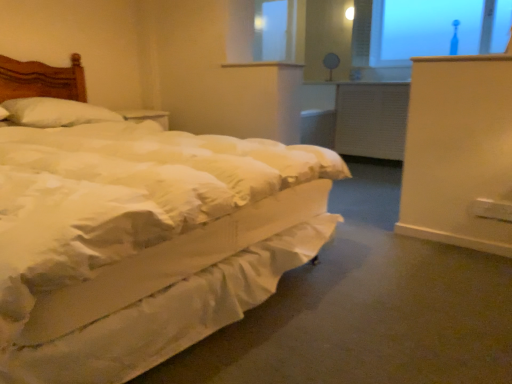
Question: Is transparent glass window at upper right wider than white soft pillow at left?

Choices:
 (A) no
 (B) yes

Answer: (A)

Question: Can you confirm if transparent glass window at upper right is positioned to the right of white soft pillow at left?

Choices:
 (A) yes
 (B) no

Answer: (A)

Question: Does transparent glass window at upper right have a lesser height compared to white soft pillow at left?

Choices:
 (A) yes
 (B) no

Answer: (B)

Question: Is transparent glass window at upper right outside white soft pillow at left?

Choices:
 (A) yes
 (B) no

Answer: (A)

Question: Is transparent glass window at upper right directly adjacent to white soft pillow at left?

Choices:
 (A) no
 (B) yes

Answer: (A)

Question: From the image's perspective, is matte white table lamp at upper center above or below white soft bed at left?

Choices:
 (A) above
 (B) below

Answer: (A)

Question: In terms of width, does matte white table lamp at upper center look wider or thinner when compared to white soft bed at left?

Choices:
 (A) thin
 (B) wide

Answer: (A)

Question: Visually, is matte white table lamp at upper center positioned to the left or to the right of white soft bed at left?

Choices:
 (A) right
 (B) left

Answer: (A)

Question: From their relative heights in the image, would you say matte white table lamp at upper center is taller or shorter than white soft bed at left?

Choices:
 (A) short
 (B) tall

Answer: (A)

Question: Considering the positions of transparent glass window at upper right and matte white table lamp at upper center in the image, is transparent glass window at upper right bigger or smaller than matte white table lamp at upper center?

Choices:
 (A) small
 (B) big

Answer: (B)

Question: Visually, is transparent glass window at upper right positioned to the left or to the right of matte white table lamp at upper center?

Choices:
 (A) right
 (B) left

Answer: (A)

Question: From their relative heights in the image, would you say transparent glass window at upper right is taller or shorter than matte white table lamp at upper center?

Choices:
 (A) short
 (B) tall

Answer: (B)

Question: Is transparent glass window at upper right in front of or behind matte white table lamp at upper center in the image?

Choices:
 (A) behind
 (B) front

Answer: (B)

Question: From a real-world perspective, is white soft bed at left above or below white textured radiator at center?

Choices:
 (A) above
 (B) below

Answer: (A)

Question: Considering the positions of point (89, 360) and point (401, 115), is point (89, 360) closer or farther from the camera than point (401, 115)?

Choices:
 (A) closer
 (B) farther

Answer: (A)